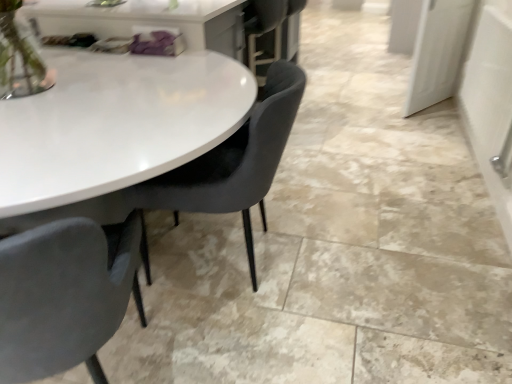
You are a GUI agent. You are given a task and a screenshot of the screen. Output one action in this format:
    pyautogui.click(x=<x>, y=<y>)
    Task: Click on the free point to the left of white glossy door at upper right
    
    Given the screenshot: What is the action you would take?
    pyautogui.click(x=367, y=107)